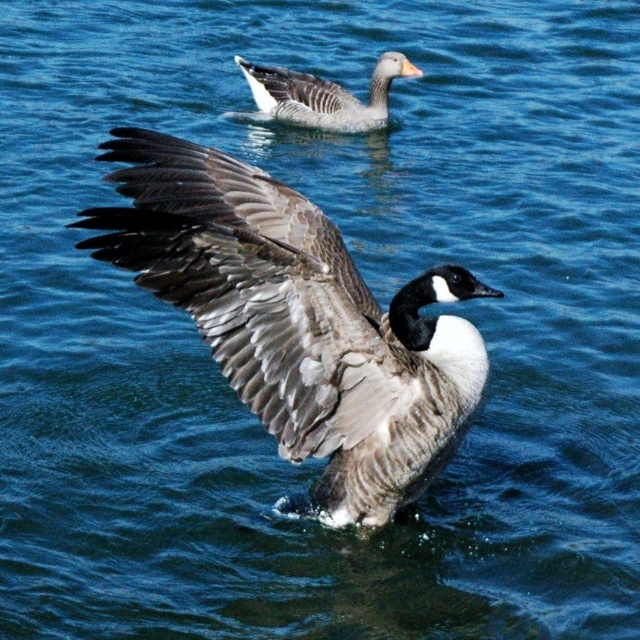
You are standing at the edge of the lake and see two points marked on the water surface. The first point is at coordinates point (273,234) and the second is at point (328,81). Which point is closer to you?

Point (273,234) is in front of point (328,81), so it is closer to you.